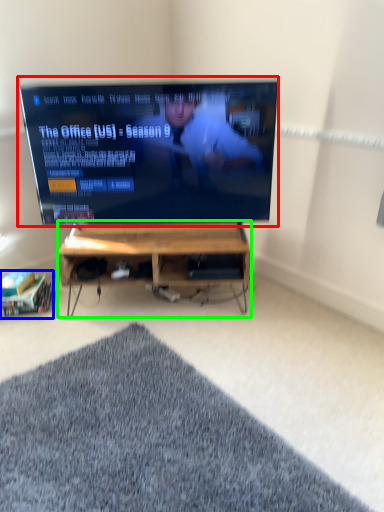
Question: Considering the real-world distances, which object is closest to television (highlighted by a red box)? shelf (highlighted by a blue box) or desk (highlighted by a green box).

Choices:
 (A) shelf
 (B) desk

Answer: (B)